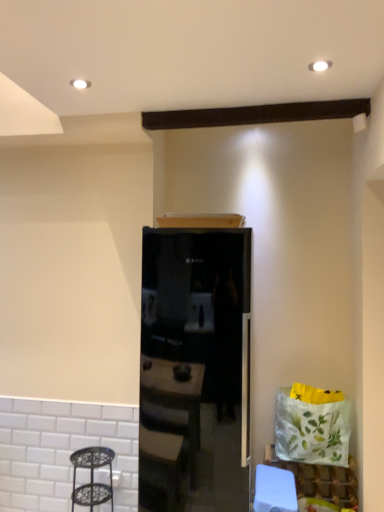
Where is `metallic black step stool at lower left`? metallic black step stool at lower left is located at coordinates (92, 477).

Which object is further away from the camera taking this photo, metallic black step stool at lower left or white paper bag at lower right?

white paper bag at lower right is further from the camera.

Is metallic black step stool at lower left wider than white paper bag at lower right?

Yes.

Is metallic black step stool at lower left not near white paper bag at lower right?

Yes, metallic black step stool at lower left and white paper bag at lower right are located far from each other.

Could you tell me if metallic black step stool at lower left is turned towards white paper bag at lower right?

No, metallic black step stool at lower left is not oriented towards white paper bag at lower right.

Which is more distant, (234, 361) or (103, 464)?

The point (103, 464) is more distant.

Image resolution: width=384 pixels, height=512 pixels. Identify the location of step stool that is under the black glass refrigerator at center (from a real-world perspective). click(x=92, y=477).

Is black glass refrigerator at center to the right of metallic black step stool at lower left from the viewer's perspective?

Indeed, black glass refrigerator at center is positioned on the right side of metallic black step stool at lower left.

Is black glass refrigerator at center positioned far away from metallic black step stool at lower left?

They are positioned close to each other.

From a real-world perspective, does metallic black step stool at lower left sit lower than black glass refrigerator at center?

Indeed, from a real-world perspective, metallic black step stool at lower left is positioned beneath black glass refrigerator at center.

Considering the positions of objects metallic black step stool at lower left and black glass refrigerator at center in the image provided, who is more to the right, metallic black step stool at lower left or black glass refrigerator at center?

From the viewer's perspective, black glass refrigerator at center appears more on the right side.

Between metallic black step stool at lower left and black glass refrigerator at center, which one has smaller size?

Smaller between the two is metallic black step stool at lower left.

Considering the relative sizes of metallic black step stool at lower left and black glass refrigerator at center in the image provided, is metallic black step stool at lower left shorter than black glass refrigerator at center?

Yes, metallic black step stool at lower left is shorter than black glass refrigerator at center.

Is black glass refrigerator at center taller or shorter than white paper bag at lower right?

Clearly, black glass refrigerator at center is taller compared to white paper bag at lower right.

Looking at this image, between black glass refrigerator at center and white paper bag at lower right, which one appears on the left side from the viewer's perspective?

black glass refrigerator at center is more to the left.

Looking at this image, is black glass refrigerator at center placed right next to white paper bag at lower right?

No, black glass refrigerator at center is not touching white paper bag at lower right.

Which object is thinner, white paper bag at lower right or metallic black step stool at lower left?

With smaller width is white paper bag at lower right.

Is white paper bag at lower right beside metallic black step stool at lower left?

white paper bag at lower right and metallic black step stool at lower left are not in contact.

Is white paper bag at lower right situated inside metallic black step stool at lower left or outside?

white paper bag at lower right lies outside metallic black step stool at lower left.

From the image's perspective, between white paper bag at lower right and metallic black step stool at lower left, who is located below?

From the image's view, white paper bag at lower right is below.

From a real-world perspective, which is physically above, white paper bag at lower right or black glass refrigerator at center?

black glass refrigerator at center.

Between white paper bag at lower right and black glass refrigerator at center, which one is positioned behind?

white paper bag at lower right is behind.

Is point (323, 475) positioned behind point (182, 478)?

Yes, point (323, 475) is farther from viewer.

This screenshot has width=384, height=512. I want to click on step stool above the white paper bag at lower right (from the image's perspective), so click(x=92, y=477).

Find the location of a particular element. Image resolution: width=384 pixels, height=512 pixels. appliance that appears above the metallic black step stool at lower left (from a real-world perspective) is located at coordinates (195, 370).

Looking at the image, which one is located closer to black glass refrigerator at center, metallic black step stool at lower left or white paper bag at lower right?

The object closer to black glass refrigerator at center is metallic black step stool at lower left.

When comparing their distances from white paper bag at lower right, does black glass refrigerator at center or metallic black step stool at lower left seem further?

Based on the image, metallic black step stool at lower left appears to be further to white paper bag at lower right.

Looking at this image, based on their spatial positions, is white paper bag at lower right or metallic black step stool at lower left closer to black glass refrigerator at center?

metallic black step stool at lower left is positioned closer to the anchor black glass refrigerator at center.

From the image, which object appears to be nearer to white paper bag at lower right, metallic black step stool at lower left or black glass refrigerator at center?

The object closer to white paper bag at lower right is black glass refrigerator at center.

Based on their spatial positions, is white paper bag at lower right or black glass refrigerator at center closer to metallic black step stool at lower left?

black glass refrigerator at center.

Based on their spatial positions, is black glass refrigerator at center or white paper bag at lower right closer to metallic black step stool at lower left?

Based on the image, black glass refrigerator at center appears to be nearer to metallic black step stool at lower left.

Locate an element on the screen. appliance between metallic black step stool at lower left and white paper bag at lower right is located at coordinates (195, 370).